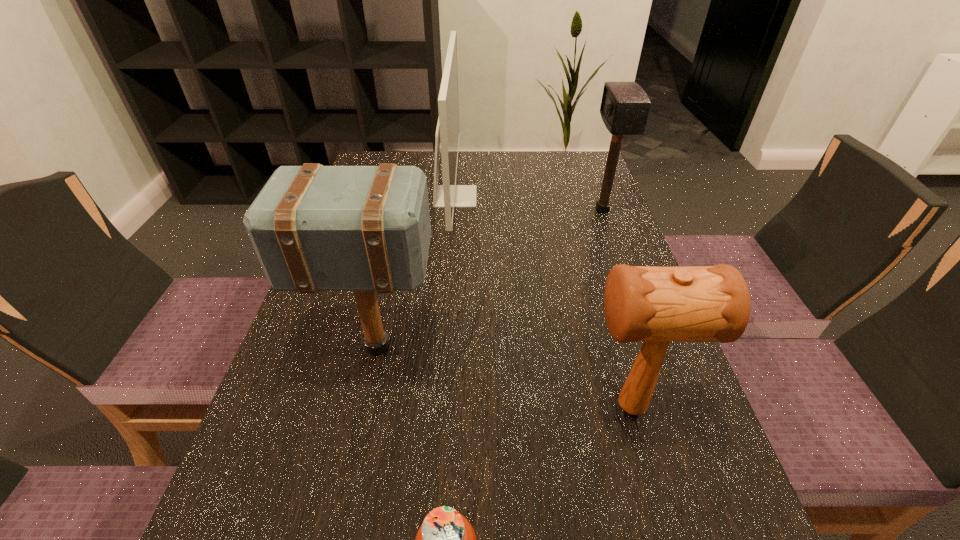
At what (x,y) coordinates should I click in order to perform the action: click on vacant space at the right edge of the desktop. Please return your answer as a coordinate pair (x, y). This screenshot has height=540, width=960. Looking at the image, I should click on (676, 516).

This screenshot has width=960, height=540. Identify the location of free space between the farthest mallet and the leftmost mallet. (489, 279).

I want to click on unoccupied area between the farthest mallet and the leftmost mallet, so click(x=489, y=279).

Identify which object is located as the third nearest to the farthest mallet. Please provide its 2D coordinates. Your answer should be formatted as a tuple, i.e. [(x, y)], where the tuple contains the x and y coordinates of a point satisfying the conditions above.

[(314, 228)]

Where is `object that stands as the closest to the shortest object`? The image size is (960, 540). object that stands as the closest to the shortest object is located at coordinates coord(656,305).

Identify which mallet is the nearest to the leftmost mallet. Please provide its 2D coordinates. Your answer should be formatted as a tuple, i.e. [(x, y)], where the tuple contains the x and y coordinates of a point satisfying the conditions above.

[(656, 305)]

Find the location of a particular element. the closest mallet relative to the farthest mallet is located at coordinates (x=656, y=305).

Locate an element on the screen. The image size is (960, 540). free space that satisfies the following two spatial constraints: 1. on the front-facing side of the farthest mallet; 2. on the left side of the monitor is located at coordinates (454, 210).

Image resolution: width=960 pixels, height=540 pixels. Find the location of `free location that satisfies the following two spatial constraints: 1. on the front-facing side of the monitor; 2. on the left side of the farthest mallet`. free location that satisfies the following two spatial constraints: 1. on the front-facing side of the monitor; 2. on the left side of the farthest mallet is located at coordinates (454, 210).